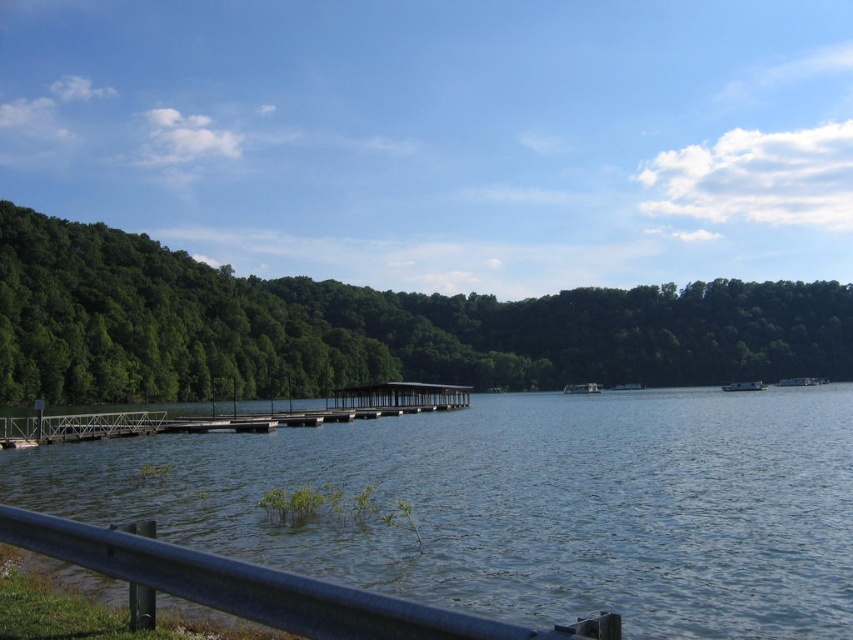
Is metallic silver boat at center-right smaller than white glossy boat at center?

Actually, metallic silver boat at center-right might be larger than white glossy boat at center.

Can you confirm if metallic silver boat at center-right is positioned above white glossy boat at center?

Yes, metallic silver boat at center-right is above white glossy boat at center.

This screenshot has height=640, width=853. What do you see at coordinates (799, 381) in the screenshot?
I see `metallic silver boat at center-right` at bounding box center [799, 381].

Where is `metallic silver boat at center-right`? The width and height of the screenshot is (853, 640). metallic silver boat at center-right is located at coordinates (799, 381).

In the scene shown: Is metallic gray dock at center above metallic silver boat at center?

Yes.

Does metallic gray dock at center appear on the right side of metallic silver boat at center?

Incorrect, metallic gray dock at center is not on the right side of metallic silver boat at center.

Locate an element on the screen. This screenshot has width=853, height=640. metallic gray dock at center is located at coordinates (234, 416).

Locate an element on the screen. This screenshot has width=853, height=640. metallic gray dock at center is located at coordinates (234, 416).

This screenshot has width=853, height=640. Find the location of `metallic gray dock at center`. metallic gray dock at center is located at coordinates (234, 416).

Which of these two, metallic gray dock at center or metallic silver boat at center-right, stands shorter?

metallic silver boat at center-right

Who is more distant from viewer, [402,387] or [801,378]?

Point [801,378]

Image resolution: width=853 pixels, height=640 pixels. Find the location of `metallic gray dock at center`. metallic gray dock at center is located at coordinates (234, 416).